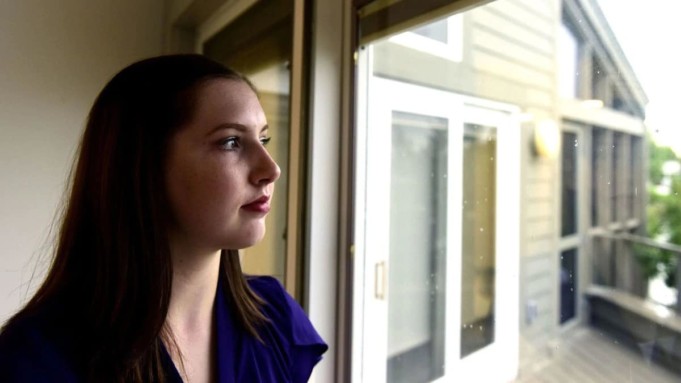
What are the coordinates of `floor` in the screenshot? It's located at (585, 368).